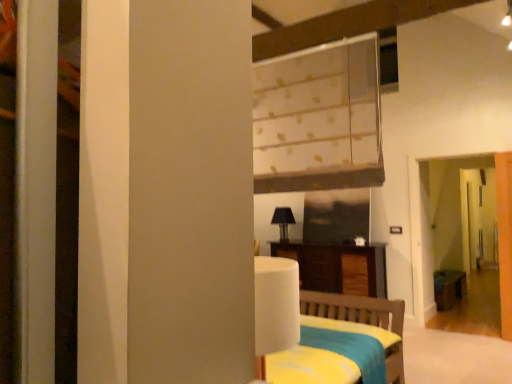
I want to click on white glossy door at right, so click(x=466, y=222).

Where is `transparent glass screen door at right`? This screenshot has height=384, width=512. transparent glass screen door at right is located at coordinates (472, 234).

What is the approximate height of black matte table lamp at center?

black matte table lamp at center is 19.31 inches in height.

Describe the element at coordinates (283, 221) in the screenshot. The image size is (512, 384). I see `black matte table lamp at center` at that location.

Find the location of a particular element. white glossy door at right is located at coordinates (466, 222).

What's the angular difference between white glossy door at right and wooden table at right's facing directions?

4.16 degrees separate the facing orientations of white glossy door at right and wooden table at right.

From a real-world perspective, who is located higher, white glossy door at right or wooden table at right?

white glossy door at right, from a real-world perspective.

Consider the image. Does white glossy door at right have a lesser height compared to wooden table at right?

No, white glossy door at right is not shorter than wooden table at right.

Between white glossy door at right and wooden table at right, which one appears on the right side from the viewer's perspective?

From the viewer's perspective, white glossy door at right appears more on the right side.

Is wooden table at right positioned with its back to black matte table lamp at center?

wooden table at right is not turned away from black matte table lamp at center.

From the image's perspective, which one is positioned lower, wooden table at right or black matte table lamp at center?

wooden table at right, from the image's perspective.

Are wooden table at right and black matte table lamp at center located far from each other?

wooden table at right is positioned a significant distance from black matte table lamp at center.

How distant is wooden table at right from black matte table lamp at center?

The distance of wooden table at right from black matte table lamp at center is 2.82 meters.

Is black matte table lamp at center directly adjacent to transparent glass screen door at right?

black matte table lamp at center and transparent glass screen door at right are not in contact.

How many degrees apart are the facing directions of black matte table lamp at center and transparent glass screen door at right?

The facing directions of black matte table lamp at center and transparent glass screen door at right are 0.55 degrees apart.

Looking at the image, does black matte table lamp at center seem bigger or smaller compared to transparent glass screen door at right?

Clearly, black matte table lamp at center is smaller in size than transparent glass screen door at right.

In order to click on table lamp above the transparent glass screen door at right (from a real-world perspective) in this screenshot , I will do `click(283, 221)`.

From a real-world perspective, who is located higher, white glossy door at right or transparent glass screen door at right?

From a 3D spatial view, white glossy door at right is above.

At what (x,y) coordinates should I click in order to perform the action: click on screen door below the white glossy door at right (from a real-world perspective). Please return your answer as a coordinate pair (x, y). This screenshot has height=384, width=512. Looking at the image, I should click on (472, 234).

Looking at the image, does white glossy door at right seem bigger or smaller compared to transparent glass screen door at right?

Clearly, white glossy door at right is smaller in size than transparent glass screen door at right.

Who is shorter, white glossy door at right or white textured blinds at upper center?

With less height is white textured blinds at upper center.

What's the angular difference between white glossy door at right and white textured blinds at upper center's facing directions?

There is a 87.6-degree angle between the facing directions of white glossy door at right and white textured blinds at upper center.

Which object is closer to the camera taking this photo, white glossy door at right or white textured blinds at upper center?

Positioned in front is white textured blinds at upper center.

Considering the sizes of objects white glossy door at right and white textured blinds at upper center in the image provided, who is smaller, white glossy door at right or white textured blinds at upper center?

With smaller size is white textured blinds at upper center.

Is dark wood cabinet at center placed right next to wooden table at right?

No, dark wood cabinet at center is not in contact with wooden table at right.

Is dark wood cabinet at center outside of wooden table at right?

Yes, dark wood cabinet at center is located beyond the bounds of wooden table at right.

Which of these two, dark wood cabinet at center or wooden table at right, stands shorter?

wooden table at right is shorter.

From a real-world perspective, is dark wood cabinet at center under wooden table at right?

No, from a real-world perspective, dark wood cabinet at center is not beneath wooden table at right.

Can we say transparent glass screen door at right lies outside white glossy door at right?

Yes, transparent glass screen door at right is outside of white glossy door at right.

Between transparent glass screen door at right and white glossy door at right, which one has smaller width?

With smaller width is white glossy door at right.

Based on the photo, would you say transparent glass screen door at right is to the left or to the right of white glossy door at right in the picture?

transparent glass screen door at right is positioned on white glossy door at right's left side.

Is transparent glass screen door at right oriented away from white glossy door at right?

Absolutely, transparent glass screen door at right is directed away from white glossy door at right.

You are a GUI agent. You are given a task and a screenshot of the screen. Output one action in this format:
    pyautogui.click(x=<x>, y=<y>)
    Task: Click on the table below the white glossy door at right (from the image's perspective)
    
    Given the screenshot: What is the action you would take?
    pyautogui.click(x=447, y=288)

Locate an element on the screen. table lamp in front of the wooden table at right is located at coordinates click(283, 221).

Estimate the real-world distances between objects in this image. Which object is closer to dark wood cabinet at center, white glossy door at right or transparent glass screen door at right?

transparent glass screen door at right is positioned closer to the anchor dark wood cabinet at center.

Based on their spatial positions, is black matte table lamp at center or white textured blinds at upper center further from dark wood cabinet at center?

Among the two, white textured blinds at upper center is located further to dark wood cabinet at center.

When comparing their distances from wooden table at right, does white textured blinds at upper center or transparent glass screen door at right seem further?

Among the two, white textured blinds at upper center is located further to wooden table at right.

Considering their positions, is black matte table lamp at center positioned further to white glossy door at right than white textured blinds at upper center?

white textured blinds at upper center is positioned further to the anchor white glossy door at right.

Estimate the real-world distances between objects in this image. Which object is further from white textured blinds at upper center, transparent glass screen door at right or black matte table lamp at center?

Based on the image, transparent glass screen door at right appears to be further to white textured blinds at upper center.

Looking at the image, which one is located closer to white glossy door at right, wooden table at right or transparent glass screen door at right?

transparent glass screen door at right is closer to white glossy door at right.

Which object lies further to the anchor point wooden table at right, black matte table lamp at center or transparent glass screen door at right?

Based on the image, black matte table lamp at center appears to be further to wooden table at right.

Based on their spatial positions, is transparent glass screen door at right or white glossy door at right closer to wooden table at right?

The object closer to wooden table at right is transparent glass screen door at right.

Image resolution: width=512 pixels, height=384 pixels. I want to click on furniture between black matte table lamp at center and wooden table at right, so click(x=337, y=266).

Locate an element on the screen. This screenshot has width=512, height=384. table between white textured blinds at upper center and white glossy door at right along the z-axis is located at coordinates (447, 288).

Locate an element on the screen. This screenshot has width=512, height=384. screen door positioned between white textured blinds at upper center and black matte table lamp at center from near to far is located at coordinates (472, 234).

You are a GUI agent. You are given a task and a screenshot of the screen. Output one action in this format:
    pyautogui.click(x=<x>, y=<y>)
    Task: Click on the table lamp located between white textured blinds at upper center and white glossy door at right in the depth direction
    
    Given the screenshot: What is the action you would take?
    pyautogui.click(x=283, y=221)